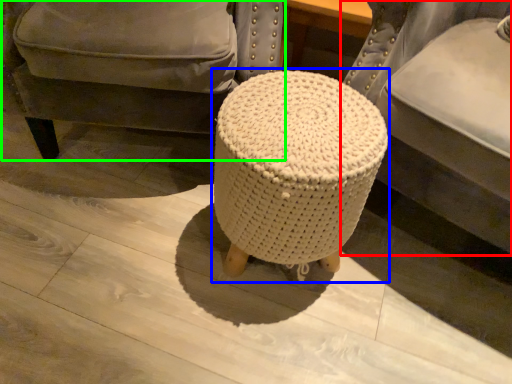
Question: Estimate the real-world distances between objects in this image. Which object is farther from furniture (highlighted by a red box), bar stool (highlighted by a blue box) or chair (highlighted by a green box)?

Choices:
 (A) bar stool
 (B) chair

Answer: (B)